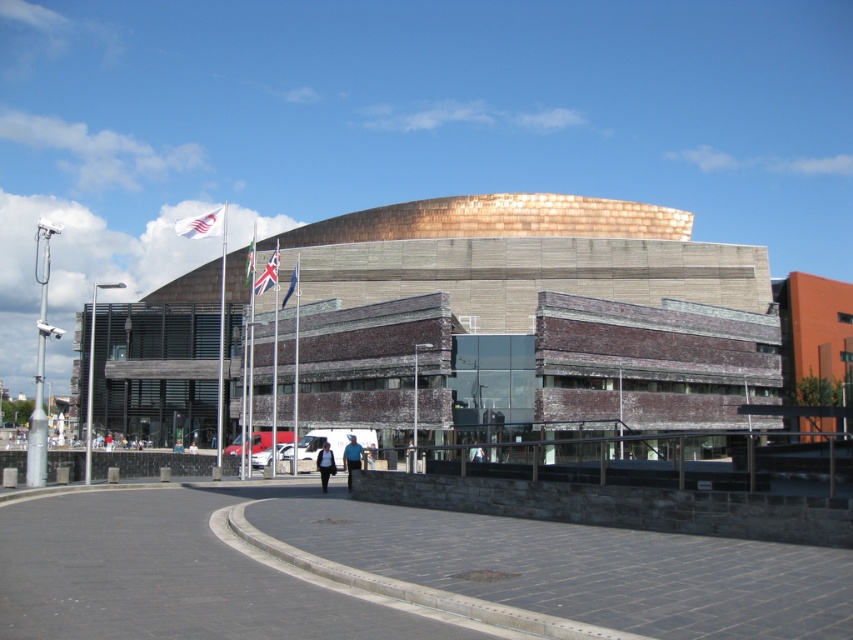
Question: Does white fabric flag at upper left appear over green fabric flag at center?

Choices:
 (A) yes
 (B) no

Answer: (A)

Question: Can you confirm if blue fabric jacket at center is positioned below blue fabric flag at left?

Choices:
 (A) yes
 (B) no

Answer: (A)

Question: Which object is farther from the camera taking this photo?

Choices:
 (A) blue denim jacket at center
 (B) dark gray jacket at center
 (C) green fabric flag at center
 (D) union jack fabric flag at center

Answer: (A)

Question: Which point is closer to the camera?

Choices:
 (A) union jack fabric flag at center
 (B) white fabric person at center
 (C) green fabric flag at center
 (D) blue fabric jacket at center

Answer: (D)

Question: Does union jack fabric flag at center appear over dark gray jacket at center?

Choices:
 (A) yes
 (B) no

Answer: (A)

Question: Which of the following is the farthest from the observer?

Choices:
 (A) dark gray jacket at center
 (B) white fabric flag at upper left
 (C) white fabric person at center

Answer: (C)